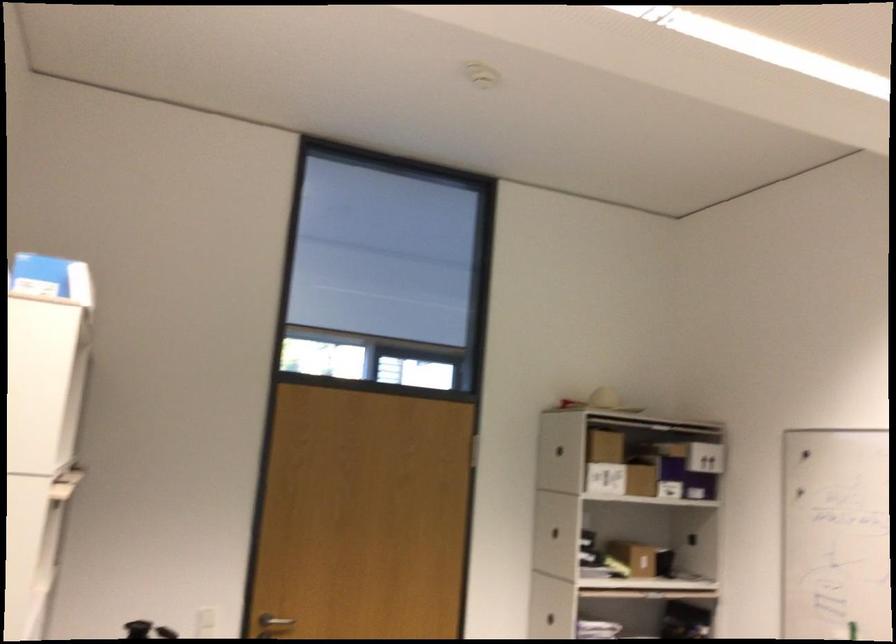
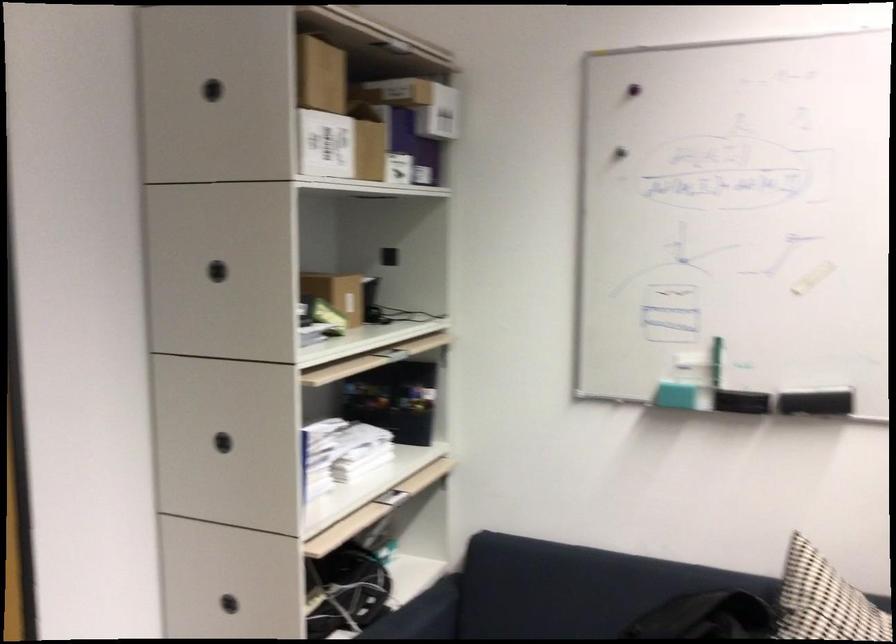
In the second image, find the point that corresponds to pixel 616 476 in the first image.

(340, 146)